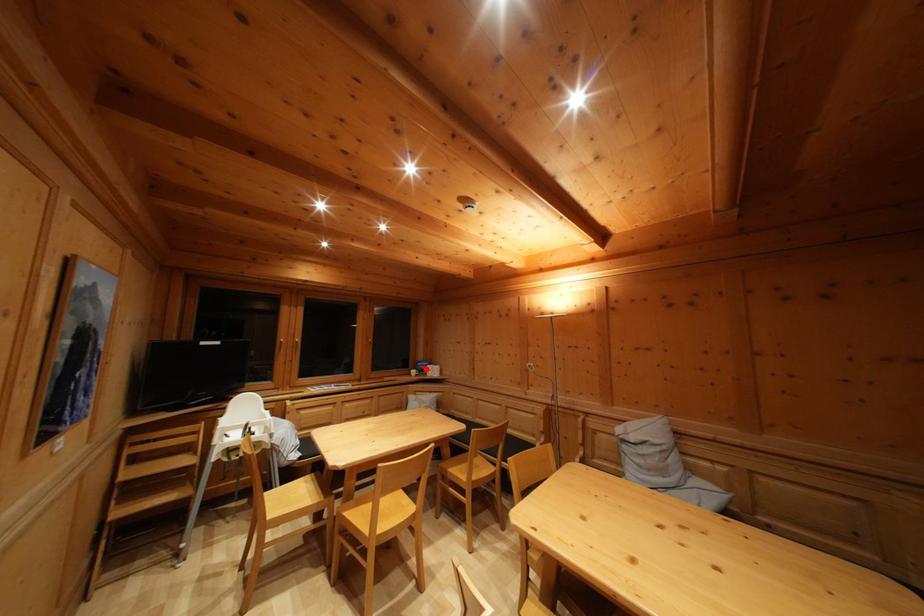
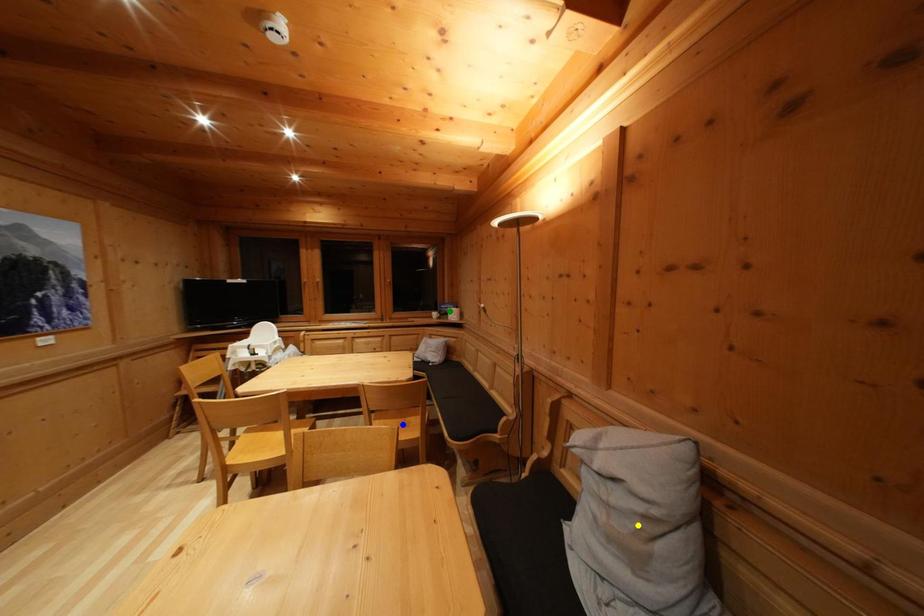
Question: I am providing you with two images of the same scene from different viewpoints. A red point is marked on the first image. You are given multiple points on the second image. Which point in image 2 represents the same 3d spot as the red point in image 1?

Choices:
 (A) green point
 (B) yellow point
 (C) blue point

Answer: (A)